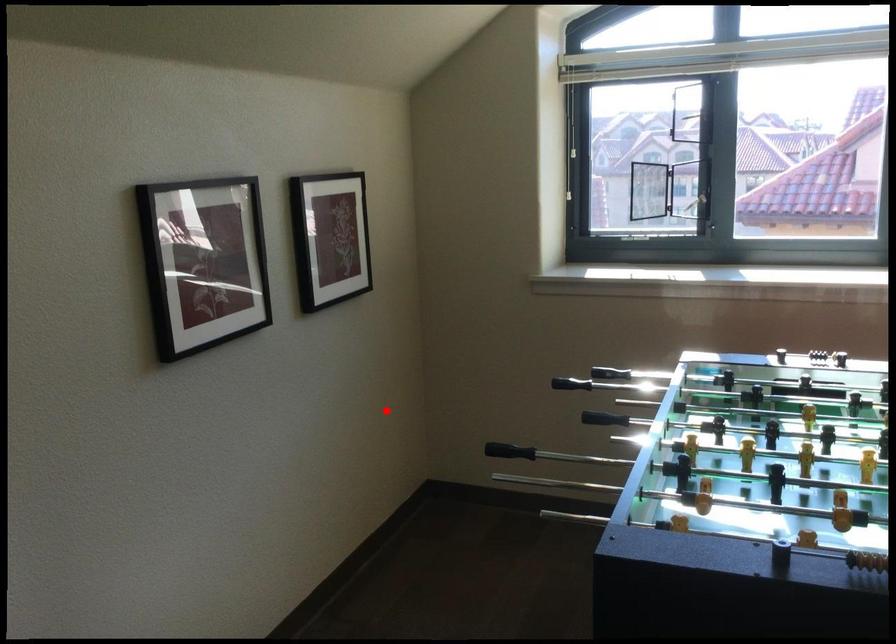
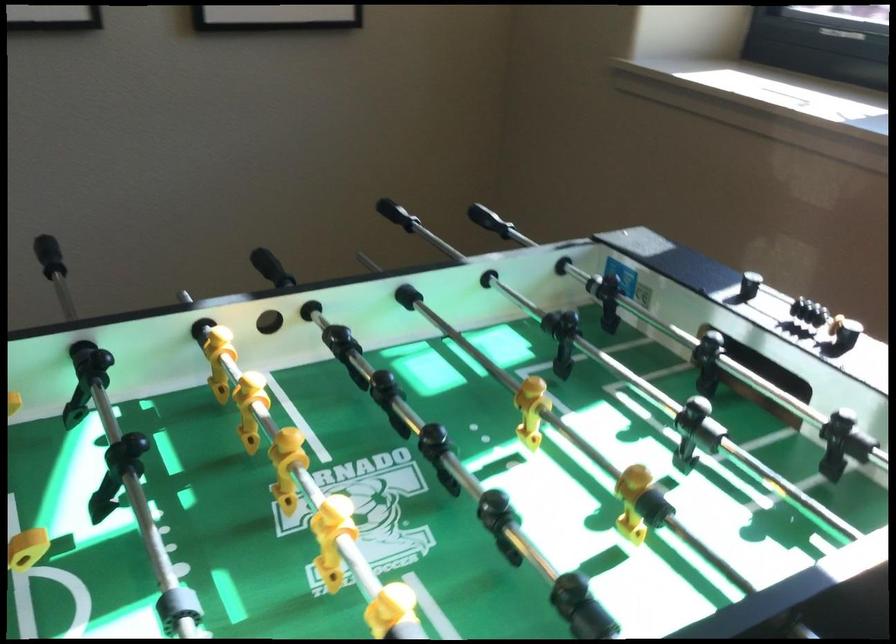
Question: I am providing you with two images of the same scene from different viewpoints. In image1, a red point is highlighted. Considering the same 3D point in image2, which of the following is correct?

Choices:
 (A) It is closer
 (B) It is farther

Answer: (A)